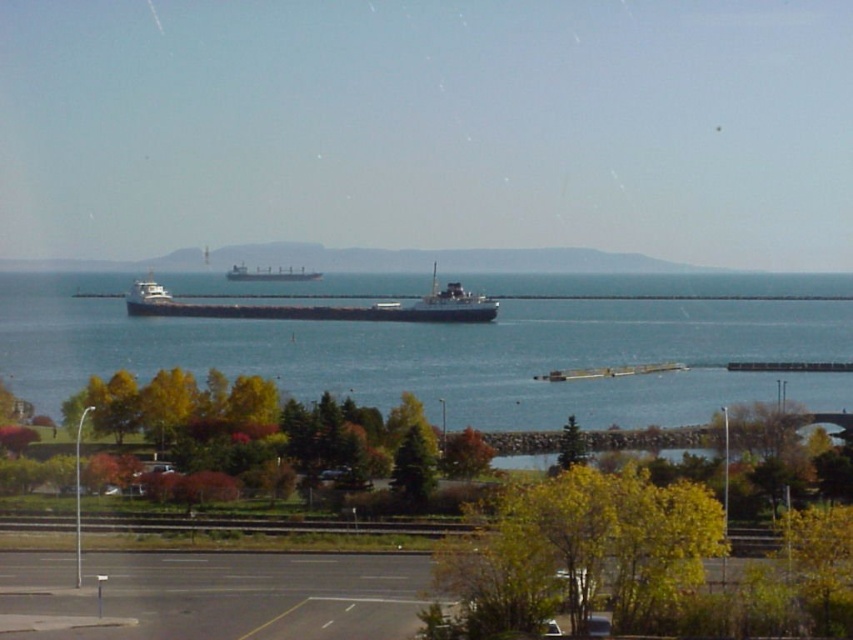
You are standing on the paved road in the coastal area and want to reach the first ship. Which point, point [335,330] or point [225,275], is closer to you?

Point [335,330] is closer to the viewer than point [225,275], so you should head towards point [335,330] to reach the first ship.

You are driving along the paved road and see the blue water at center and the matte black cargo ship at center. Which object is closer to the right side of the road?

The blue water at center is closer to the right side of the road because it is positioned to the right of the matte black cargo ship at center.